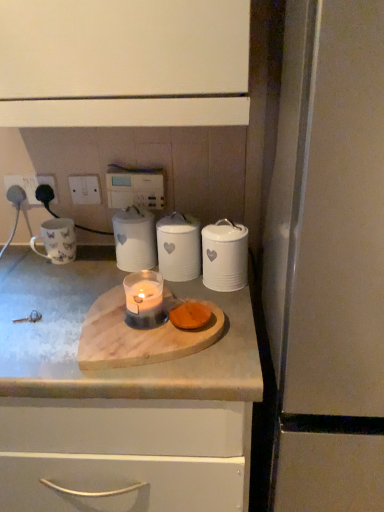
Locate an element on the screen. free space between translucent glass candle at center and matte white mug at left is located at coordinates (82, 278).